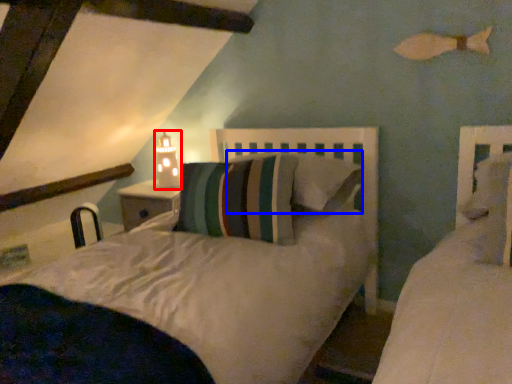
Question: Among these objects, which one is farthest to the camera, table lamp (highlighted by a red box) or pillow (highlighted by a blue box)?

Choices:
 (A) table lamp
 (B) pillow

Answer: (A)